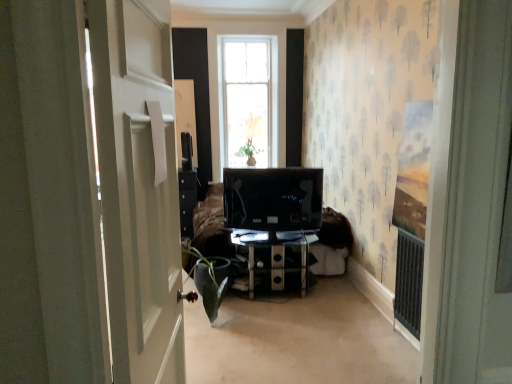
Question: Can you confirm if white glossy door at left is shorter than green matte plant at lower left?

Choices:
 (A) yes
 (B) no

Answer: (B)

Question: Is white glossy door at left positioned far away from green matte plant at lower left?

Choices:
 (A) no
 (B) yes

Answer: (B)

Question: Is white glossy door at left outside green matte plant at lower left?

Choices:
 (A) no
 (B) yes

Answer: (B)

Question: Does white glossy door at left have a greater width compared to green matte plant at lower left?

Choices:
 (A) yes
 (B) no

Answer: (B)

Question: Is white glossy door at left at the right side of green matte plant at lower left?

Choices:
 (A) no
 (B) yes

Answer: (B)

Question: Is white glossy door at left taller than green matte plant at lower left?

Choices:
 (A) no
 (B) yes

Answer: (B)

Question: Can you confirm if white glossy door at left is shorter than transparent glass tv stand at center?

Choices:
 (A) no
 (B) yes

Answer: (A)

Question: Does white glossy door at left come in front of transparent glass tv stand at center?

Choices:
 (A) yes
 (B) no

Answer: (A)

Question: From the image's perspective, is white glossy door at left located above transparent glass tv stand at center?

Choices:
 (A) yes
 (B) no

Answer: (A)

Question: Does white glossy door at left turn towards transparent glass tv stand at center?

Choices:
 (A) yes
 (B) no

Answer: (B)

Question: Is transparent glass tv stand at center inside white glossy door at left?

Choices:
 (A) no
 (B) yes

Answer: (A)

Question: Is white glossy door at left at the left side of transparent glass tv stand at center?

Choices:
 (A) yes
 (B) no

Answer: (A)

Question: From a real-world perspective, is green matte plant at lower left under transparent glass tv stand at center?

Choices:
 (A) no
 (B) yes

Answer: (A)